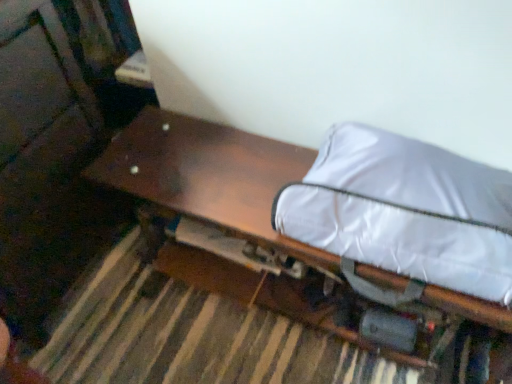
Where is `vacant space to the left of white fabric bean bag at right`? The width and height of the screenshot is (512, 384). vacant space to the left of white fabric bean bag at right is located at coordinates (232, 184).